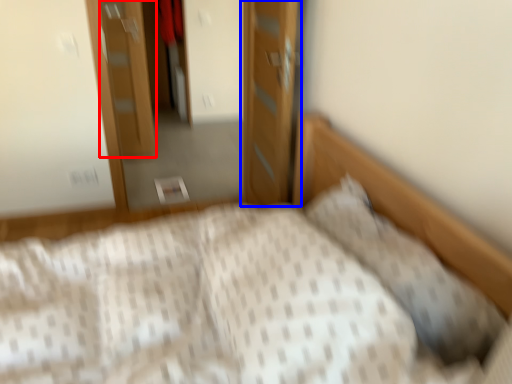
Question: Which point is closer to the camera, door (highlighted by a red box) or door (highlighted by a blue box)?

Choices:
 (A) door
 (B) door

Answer: (B)